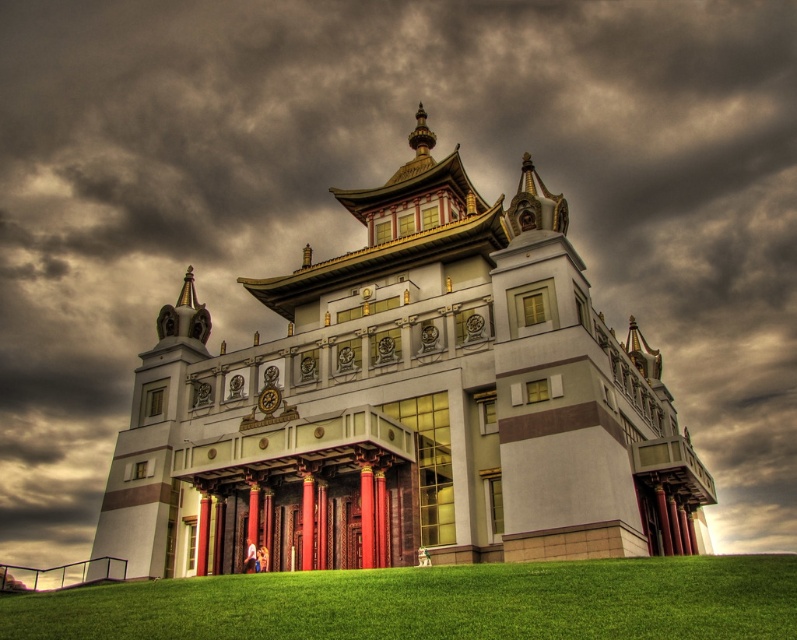
Is the position of white glossy palace at center more distant than that of green grass at lower center?

Yes, it is behind green grass at lower center.

Is white glossy palace at center below green grass at lower center?

No.

This screenshot has width=797, height=640. In order to click on white glossy palace at center in this screenshot , I will do `click(407, 404)`.

Where is `white glossy palace at center`? This screenshot has height=640, width=797. white glossy palace at center is located at coordinates (407, 404).